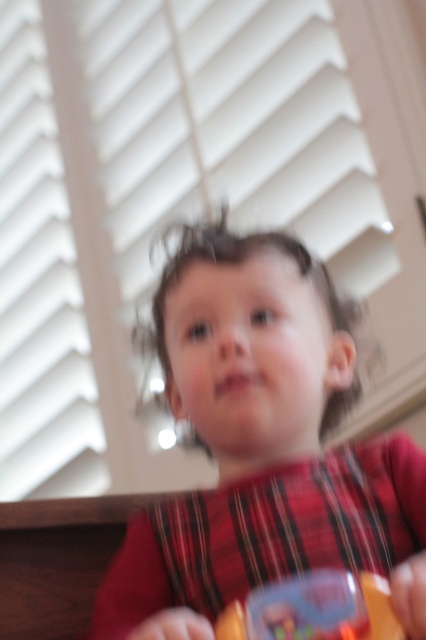
Question: Which of the following is the closest to the observer?

Choices:
 (A) white matte blinds at upper center
 (B) matte red shirt at center

Answer: (B)

Question: Can you confirm if white matte blinds at upper center is positioned below matte red shirt at center?

Choices:
 (A) yes
 (B) no

Answer: (B)

Question: Does white matte blinds at upper center appear on the right side of matte red shirt at center?

Choices:
 (A) no
 (B) yes

Answer: (A)

Question: Which is nearer to the translucent plastic toy at lower center?

Choices:
 (A) matte red shirt at center
 (B) white matte blinds at upper center

Answer: (A)

Question: Considering the real-world distances, which object is closest to the matte red shirt at center?

Choices:
 (A) white matte blinds at upper center
 (B) translucent plastic toy at lower center

Answer: (B)

Question: Does white matte blinds at upper center have a greater width compared to matte red shirt at center?

Choices:
 (A) yes
 (B) no

Answer: (A)